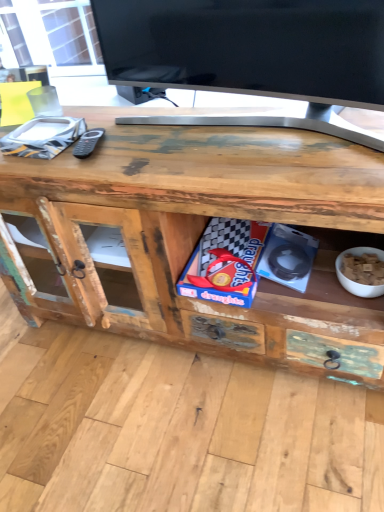
The width and height of the screenshot is (384, 512). Identify the location of free space above wooden table at center (from a real-world perspective). (195, 137).